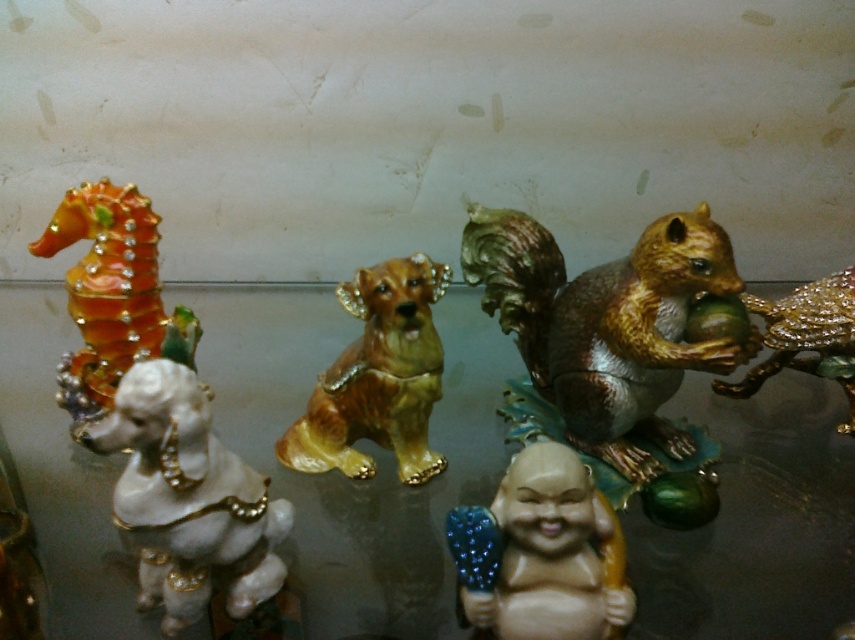
You are standing in front of the display and want to reach the point at coordinates point [523,259] and point [311,392]. Which point is closer to you?

Point [523,259] is in front of point [311,392], so it is closer to you.